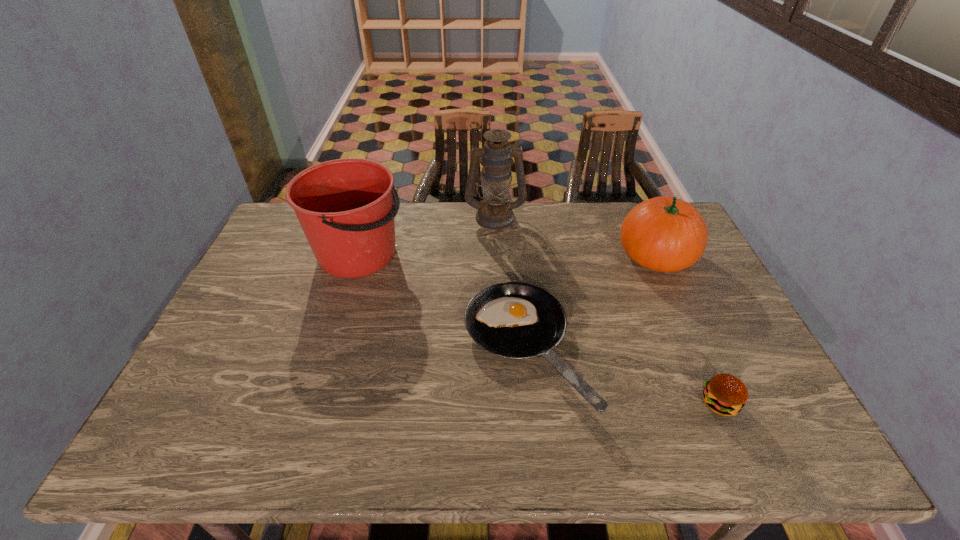
The width and height of the screenshot is (960, 540). I want to click on vacant space located 0.310m on the left of the frying pan, so click(x=347, y=349).

You are a GUI agent. You are given a task and a screenshot of the screen. Output one action in this format:
    pyautogui.click(x=<x>, y=<y>)
    Task: Click on the oil lamp at the far edge
    
    Given the screenshot: What is the action you would take?
    pyautogui.click(x=495, y=212)

I want to click on bucket that is at the far edge, so click(x=345, y=207).

Where is `pumpkin at the far edge`? pumpkin at the far edge is located at coordinates (666, 234).

Where is `object located in the near edge section of the desktop`? The height and width of the screenshot is (540, 960). object located in the near edge section of the desktop is located at coordinates (515, 320).

Where is `pumpkin located in the right edge section of the desktop`? The image size is (960, 540). pumpkin located in the right edge section of the desktop is located at coordinates (666, 234).

Identify the location of hamburger positioned at the right edge. This screenshot has width=960, height=540. (725, 395).

The image size is (960, 540). I want to click on object that is at the far right corner, so click(666, 234).

This screenshot has width=960, height=540. Find the location of `vacant point at the far edge`. vacant point at the far edge is located at coordinates (459, 239).

Identify the location of free space at the near edge of the desktop. (302, 427).